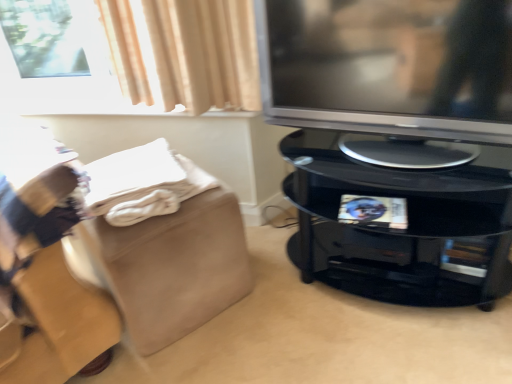
I want to click on free space between beige suede footrest at lower left and glossy black tv stand at right, so click(300, 311).